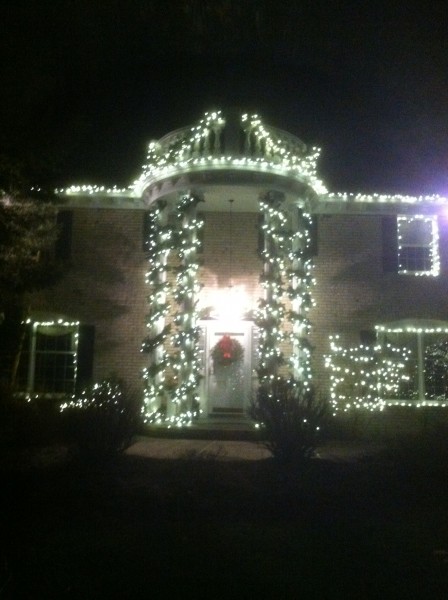
You are a GUI agent. You are given a task and a screenshot of the screen. Output one action in this format:
    pyautogui.click(x=<x>, y=<y>)
    Task: Click on the column
    
    Given the screenshot: What is the action you would take?
    pyautogui.click(x=158, y=258), pyautogui.click(x=274, y=348), pyautogui.click(x=183, y=324), pyautogui.click(x=298, y=342)